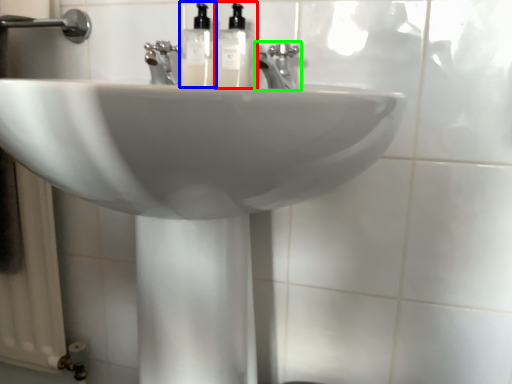
Question: Based on their relative distances, which object is nearer to soap dispenser (highlighted by a red box)? Choose from soap dispenser (highlighted by a blue box) and tap (highlighted by a green box).

Choices:
 (A) soap dispenser
 (B) tap

Answer: (A)